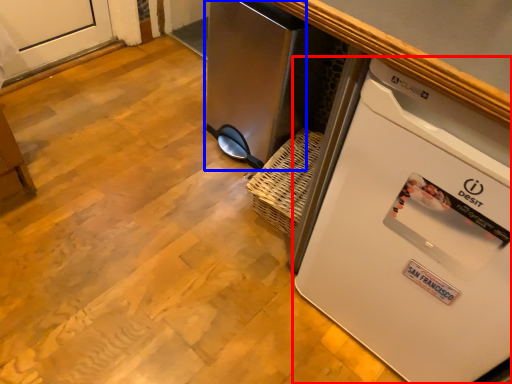
Question: Which object appears farthest to the camera in this image, home appliance (highlighted by a red box) or appliance (highlighted by a blue box)?

Choices:
 (A) home appliance
 (B) appliance

Answer: (B)